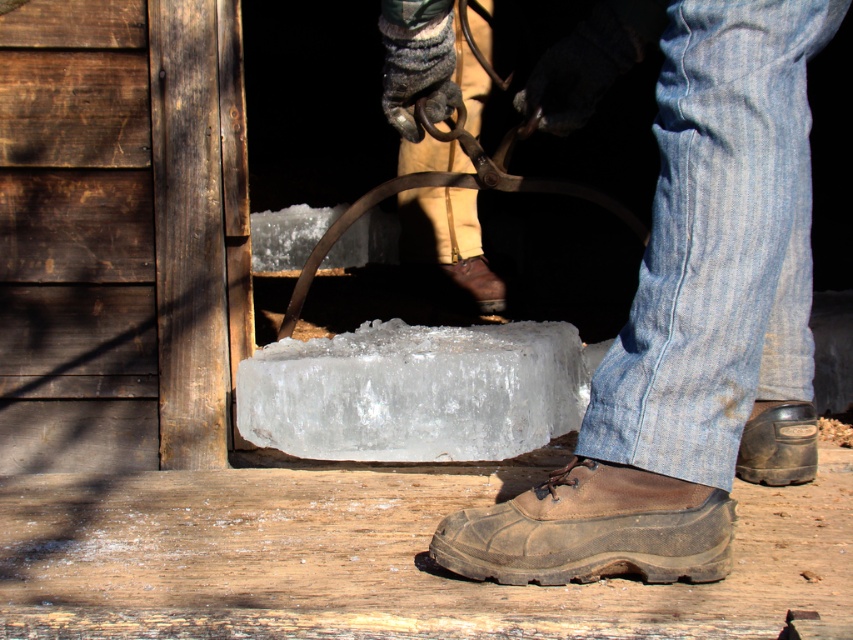
Does denim at lower right have a greater height compared to brown suede shoe at lower center?

Yes, denim at lower right is taller than brown suede shoe at lower center.

The height and width of the screenshot is (640, 853). Identify the location of denim at lower right. (718, 243).

Who is more distant from viewer, (x=724, y=412) or (x=537, y=540)?

The point (x=724, y=412) is more distant.

Identify the location of denim at lower right. The height and width of the screenshot is (640, 853). (718, 243).

Does point (604, 547) lie in front of point (485, 308)?

Yes, it is.

Is brown suede shoe at lower center shorter than brown leather shoe at center?

Indeed, brown suede shoe at lower center has a lesser height compared to brown leather shoe at center.

Who is more forward, (448, 547) or (479, 291)?

Point (448, 547) is in front.

Where is `brown suede shoe at lower center`? brown suede shoe at lower center is located at coordinates (593, 529).

From the picture: Is brown leather shoe at lower right below brown leather shoe at center?

Correct, brown leather shoe at lower right is located below brown leather shoe at center.

Where is `brown leather shoe at lower right`? brown leather shoe at lower right is located at coordinates (778, 444).